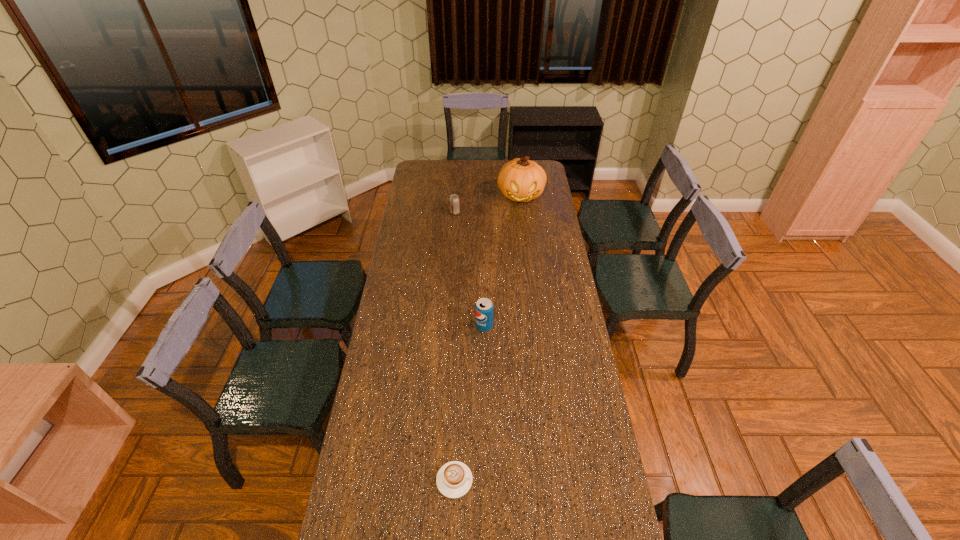
Locate an element on the screen. Image resolution: width=960 pixels, height=540 pixels. free spot located 0.160m on the right of the second farthest object is located at coordinates (489, 213).

The height and width of the screenshot is (540, 960). I want to click on free space located 0.350m with the handle on the right side of the shortest object, so click(x=582, y=480).

You are a GUI agent. You are given a task and a screenshot of the screen. Output one action in this format:
    pyautogui.click(x=<x>, y=<y>)
    Task: Click on the object located at the right edge
    The height and width of the screenshot is (540, 960).
    Given the screenshot: What is the action you would take?
    pyautogui.click(x=521, y=180)

Where is `vacant region at the far edge of the desktop`? This screenshot has width=960, height=540. vacant region at the far edge of the desktop is located at coordinates (457, 161).

Where is `free space at the left edge`? Image resolution: width=960 pixels, height=540 pixels. free space at the left edge is located at coordinates (425, 222).

This screenshot has width=960, height=540. Identify the location of vacant area at the right edge of the desktop. (556, 347).

Locate an element on the screen. This screenshot has height=540, width=960. vacant region at the far left corner of the desktop is located at coordinates (433, 170).

Find the location of a particular element. free space at the far right corner of the desktop is located at coordinates (x=540, y=161).

Locate an element on the screen. free spot between the nearer soda can and the farther soda can is located at coordinates (469, 269).

Locate an element on the screen. empty space that is in between the farthest object and the cappuccino is located at coordinates (488, 338).